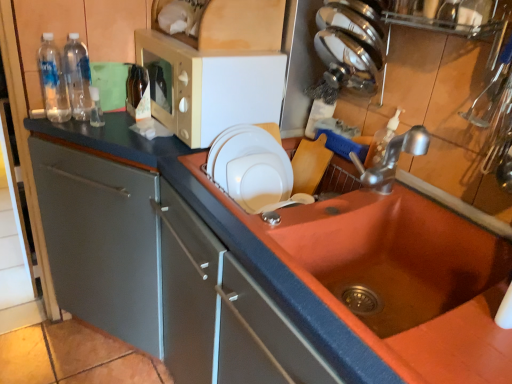
Find the location of a particular element. This screenshot has height=384, width=512. vacant space in between clear plastic bottle at left, which is the second bottle from left to right, and brown glass bottle at upper left, acting as the 1th bottle starting from the right is located at coordinates (112, 117).